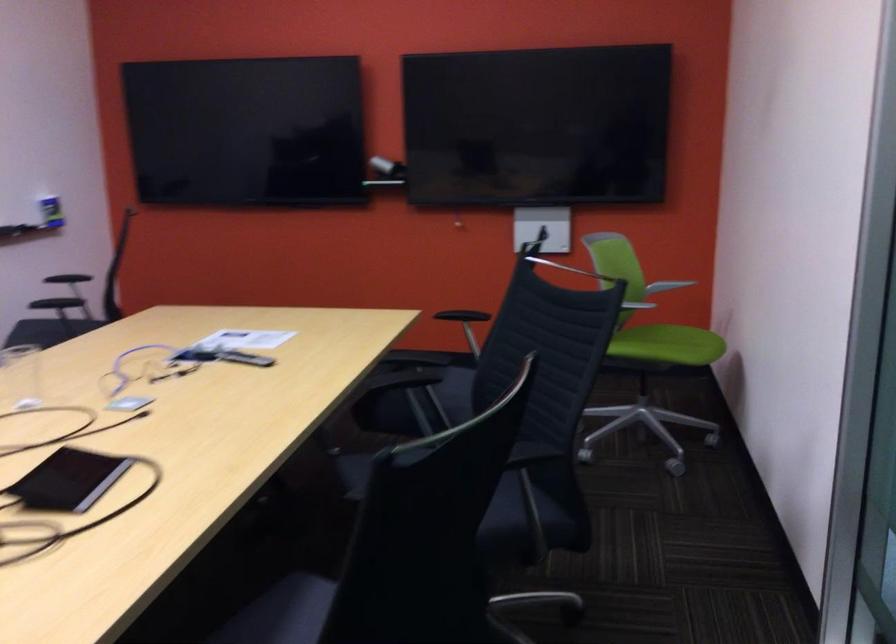
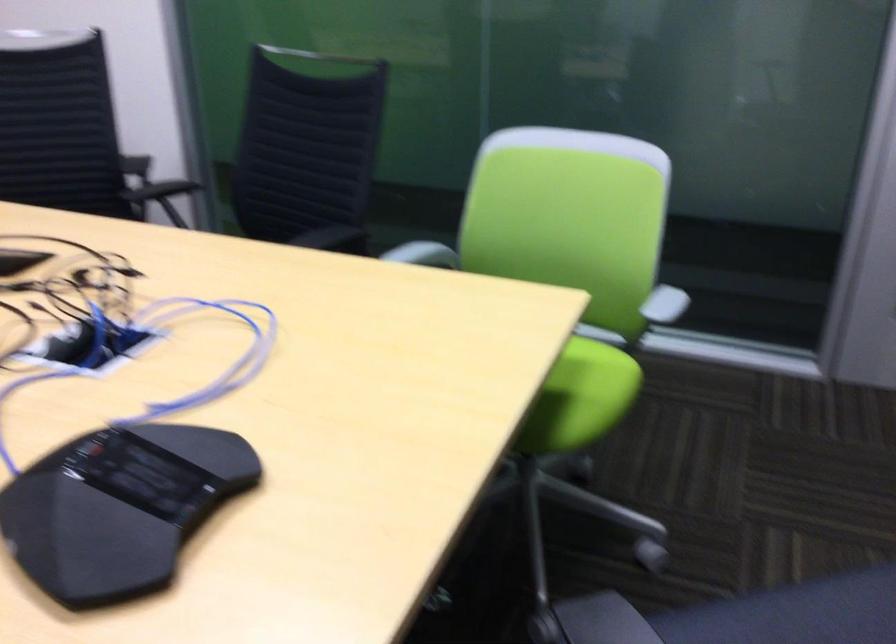
Question: I am providing you with two images of the same scene from different viewpoints. Which of the following objects are not visible in image2?

Choices:
 (A) white chair armrest
 (B) black chair sitting surface
 (C) black chair armrest
 (D) blue tool handle

Answer: (B)